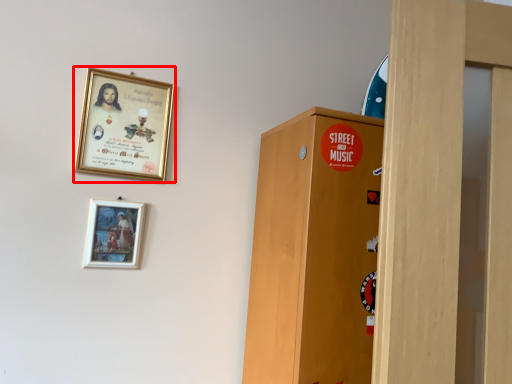
Question: Where is picture frame (annotated by the red box) located in relation to picture frame in the image?

Choices:
 (A) left
 (B) right

Answer: (B)